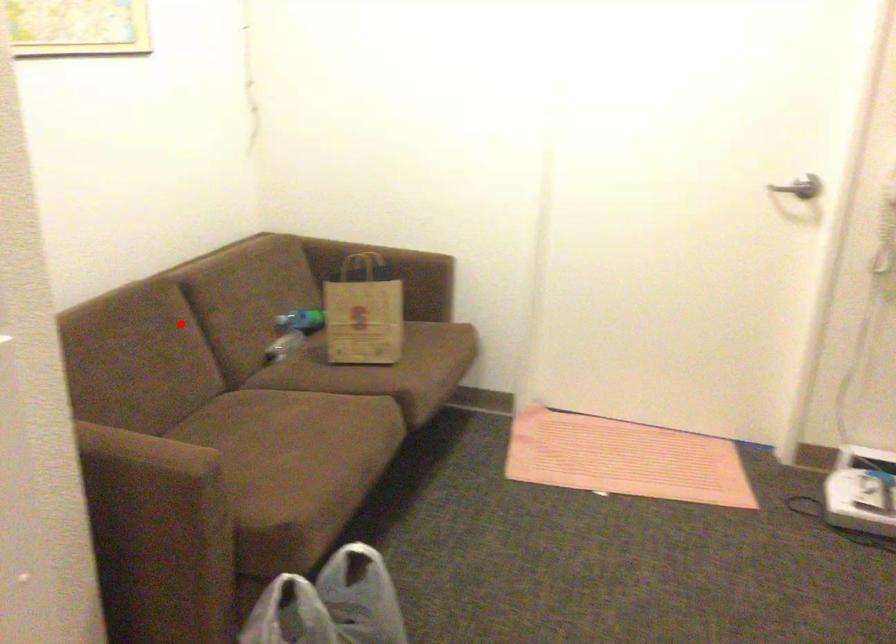
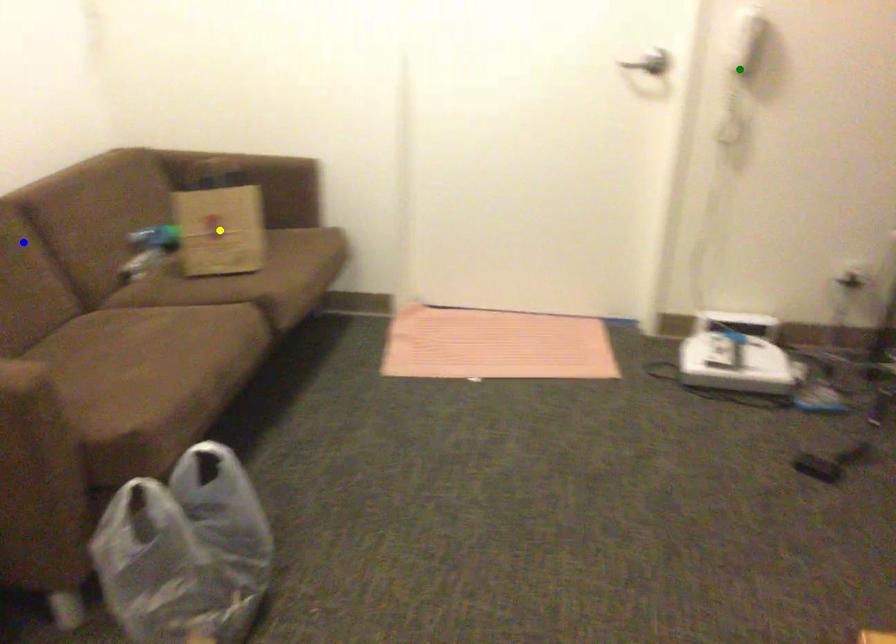
Question: I am providing you with two images of the same scene from different viewpoints. A red point is marked on the first image. You are given multiple points on the second image. Can you choose the point in image 2 that corresponds to the point in image 1?

Choices:
 (A) green point
 (B) blue point
 (C) yellow point

Answer: (B)